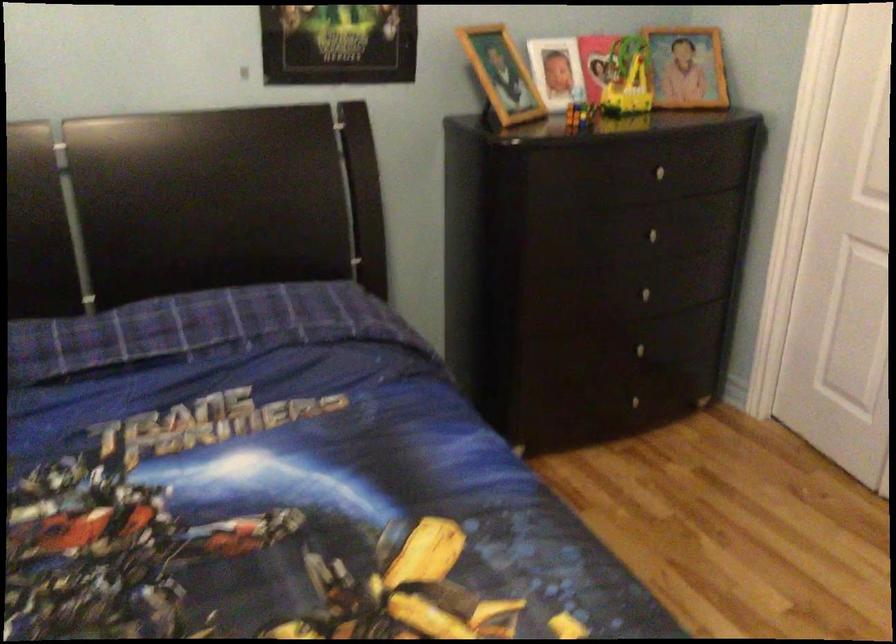
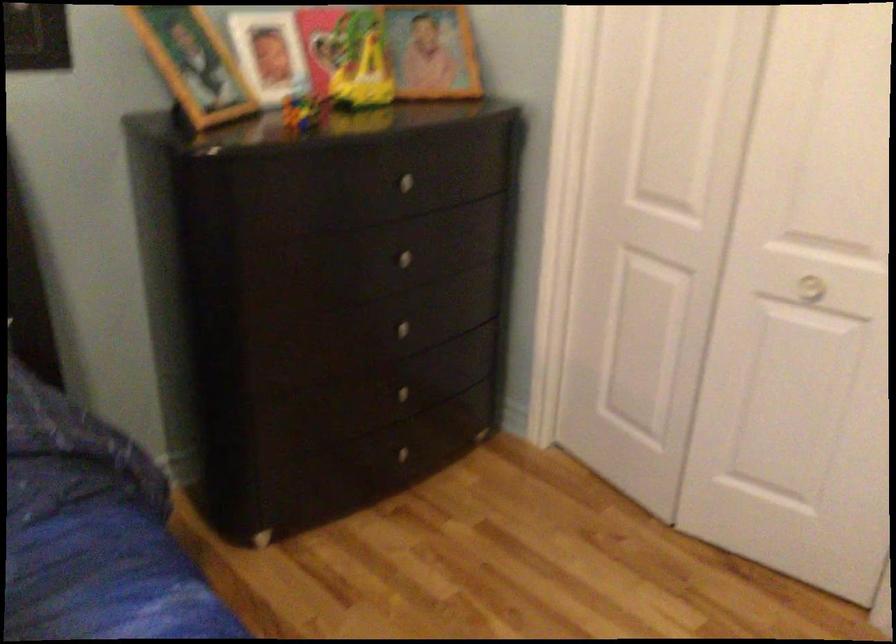
Where in the second image is the point corresponding to (x=661, y=166) from the first image?

(408, 178)